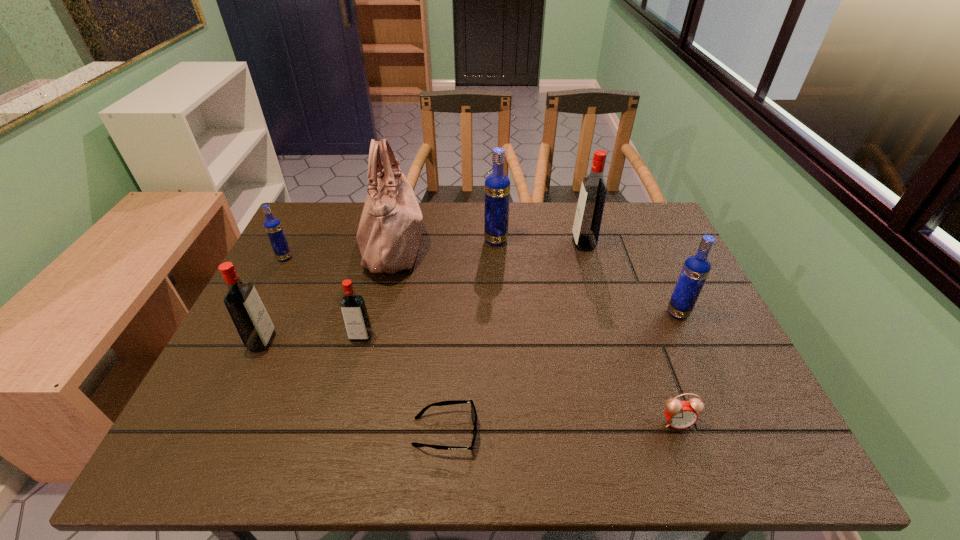
What are the coordinates of `vodka that is at the right edge` in the screenshot? It's located at (696, 268).

What are the coordinates of `alarm clock that is at the right edge` in the screenshot? It's located at (680, 414).

The width and height of the screenshot is (960, 540). What are the coordinates of `object located at the near right corner` in the screenshot? It's located at (680, 414).

Locate an element on the screen. The image size is (960, 540). vacant area at the far edge is located at coordinates (554, 206).

I want to click on vacant space at the left edge of the desktop, so click(x=317, y=266).

Identify the location of blank space at the right edge of the desktop. Image resolution: width=960 pixels, height=540 pixels. (713, 409).

This screenshot has height=540, width=960. In order to click on vacant space at the near left corner in this screenshot , I will do `click(233, 460)`.

The image size is (960, 540). Identify the location of vacant space that is in between the second biggest red vodka and the fifth vodka from left to right. (423, 292).

Find the location of `free space between the fifth vodka from right to left and the smallest red vodka`. free space between the fifth vodka from right to left and the smallest red vodka is located at coordinates (312, 339).

The width and height of the screenshot is (960, 540). Find the location of `free spot between the fourth vodka from right to left and the second shortest object`. free spot between the fourth vodka from right to left and the second shortest object is located at coordinates (518, 380).